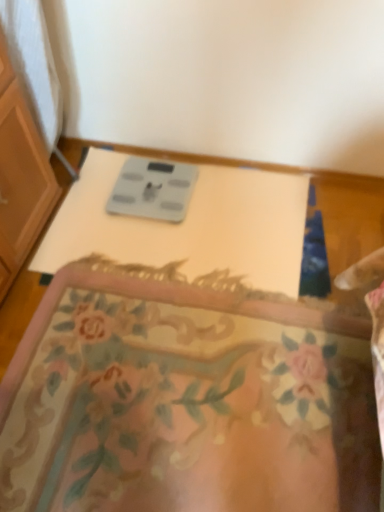
Where is `vacant area that is situated to the right of gray matte scale at center`? This screenshot has width=384, height=512. vacant area that is situated to the right of gray matte scale at center is located at coordinates (229, 200).